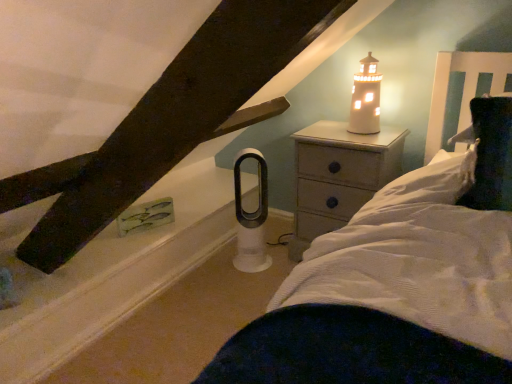
You are a GUI agent. You are given a task and a screenshot of the screen. Output one action in this format:
    pyautogui.click(x=<x>, y=<y>)
    Task: Click on the vacant space to the right of white ceramic lighthouse at upper right
    The image size is (512, 384).
    Given the screenshot: What is the action you would take?
    pyautogui.click(x=390, y=132)